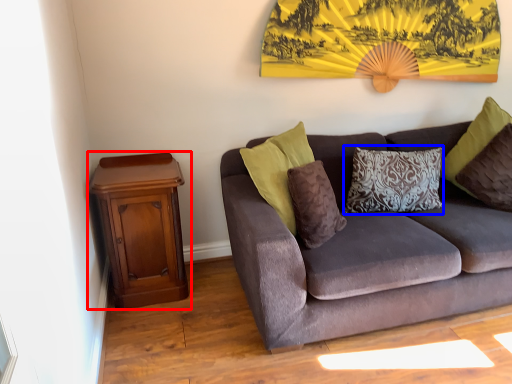
Question: Which object is further to the camera taking this photo, nightstand (highlighted by a red box) or pillow (highlighted by a blue box)?

Choices:
 (A) nightstand
 (B) pillow

Answer: (B)